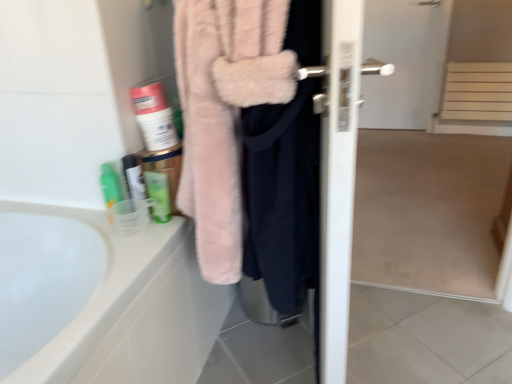
Measure the distance between point (465,11) and camera.

Point (465,11) is 3.20 meters from camera.

This screenshot has width=512, height=384. Describe the element at coordinates (135, 184) in the screenshot. I see `translucent plastic cup at lower left, the second toiletry positioned from the left` at that location.

The width and height of the screenshot is (512, 384). Describe the element at coordinates (154, 117) in the screenshot. I see `white matte bottle at upper left` at that location.

Describe the element at coordinates (282, 198) in the screenshot. I see `fuzzy pink robe at center` at that location.

What is the approximate width of fuzzy pink robe at center?

12.69 centimeters.

The image size is (512, 384). What do you see at coordinates (224, 112) in the screenshot?
I see `fluffy pink towel at upper right` at bounding box center [224, 112].

This screenshot has height=384, width=512. In order to click on white matte screen door at center in this screenshot , I will do `click(432, 159)`.

Which object is positioned more to the right, fuzzy pink robe at center or fluffy pink towel at upper right?

fuzzy pink robe at center is more to the right.

From a real-world perspective, is fuzzy pink robe at center physically above fluffy pink towel at upper right?

No, from a real-world perspective, fuzzy pink robe at center is not over fluffy pink towel at upper right

Considering the sizes of objects fuzzy pink robe at center and fluffy pink towel at upper right in the image provided, who is thinner, fuzzy pink robe at center or fluffy pink towel at upper right?

fuzzy pink robe at center is thinner.

Is fuzzy pink robe at center aimed at fluffy pink towel at upper right?

Yes, fuzzy pink robe at center is facing fluffy pink towel at upper right.

Looking at this image, which object is closer to the camera taking this photo, fluffy pink towel at upper right or translucent plastic cup at lower left, arranged as the 1th toiletry when viewed from the left?

Positioned in front is fluffy pink towel at upper right.

Based on their sizes in the image, would you say fluffy pink towel at upper right is bigger or smaller than translucent plastic cup at lower left, arranged as the third toiletry when viewed from the right?

Clearly, fluffy pink towel at upper right is larger in size than translucent plastic cup at lower left, arranged as the third toiletry when viewed from the right.

Could you measure the distance between fluffy pink towel at upper right and translucent plastic cup at lower left, arranged as the 1th toiletry when viewed from the left?

fluffy pink towel at upper right and translucent plastic cup at lower left, arranged as the 1th toiletry when viewed from the left, are 16.92 inches apart.

Which point is more forward, [192,194] or [106,187]?

The point [192,194] is closer to the camera.

How different are the orientations of translucent plastic cup at lower left, the second toiletry positioned from the left, and white matte bottle at upper left in degrees?

They differ by 0.0127 degrees in their facing directions.

Considering the relative positions of translucent plastic cup at lower left, the second toiletry positioned from the left, and white matte bottle at upper left in the image provided, is translucent plastic cup at lower left, the second toiletry positioned from the left, to the left or to the right of white matte bottle at upper left?

From the image, it's evident that translucent plastic cup at lower left, the second toiletry positioned from the left, is to the left of white matte bottle at upper left.

Are translucent plastic cup at lower left, the second toiletry positioned from the left, and white matte bottle at upper left far apart?

No.

From the image's perspective, relative to white matte bottle at upper left, is translucent plastic cup at lower left, the second toiletry positioned from the left, above or below?

From the image's perspective, translucent plastic cup at lower left, the second toiletry positioned from the left, appears below white matte bottle at upper left.

From a real-world perspective, is translucent plastic cup at lower left, the second toiletry positioned from the left, physically above green matte tube at upper left, the 1th toiletry viewed from the right?

Yes, from a real-world perspective, translucent plastic cup at lower left, the second toiletry positioned from the left, is on top of green matte tube at upper left, the 1th toiletry viewed from the right.

Which of these two, translucent plastic cup at lower left, the second toiletry positioned from the left, or green matte tube at upper left, the 1th toiletry viewed from the right, stands taller?

translucent plastic cup at lower left, the second toiletry positioned from the left, is taller.

Considering the relative positions of translucent plastic cup at lower left, placed as the second toiletry when sorted from right to left, and green matte tube at upper left, positioned as the 3th toiletry in left-to-right order, in the image provided, is translucent plastic cup at lower left, placed as the second toiletry when sorted from right to left, to the right of green matte tube at upper left, positioned as the 3th toiletry in left-to-right order, from the viewer's perspective?

Incorrect, translucent plastic cup at lower left, placed as the second toiletry when sorted from right to left, is not on the right side of green matte tube at upper left, positioned as the 3th toiletry in left-to-right order.

Is translucent plastic cup at lower left, placed as the second toiletry when sorted from right to left, facing away from green matte tube at upper left, positioned as the 3th toiletry in left-to-right order?

translucent plastic cup at lower left, placed as the second toiletry when sorted from right to left, is not turned away from green matte tube at upper left, positioned as the 3th toiletry in left-to-right order.

From a real-world perspective, does fluffy pink towel at upper right sit lower than fuzzy pink robe at center?

No, from a real-world perspective, fluffy pink towel at upper right is not under fuzzy pink robe at center.

Is fluffy pink towel at upper right taller or shorter than fuzzy pink robe at center?

Clearly, fluffy pink towel at upper right is shorter compared to fuzzy pink robe at center.

Measure the distance from fluffy pink towel at upper right to fuzzy pink robe at center.

3.91 inches.

Is fluffy pink towel at upper right aimed at fuzzy pink robe at center?

Yes, fluffy pink towel at upper right faces towards fuzzy pink robe at center.

From a real-world perspective, who is located lower, translucent plastic cup at lower left, arranged as the 1th toiletry when viewed from the left, or translucent plastic cup at lower left, the second toiletry positioned from the left?

From a 3D spatial view, translucent plastic cup at lower left, arranged as the 1th toiletry when viewed from the left, is below.

How different are the orientations of translucent plastic cup at lower left, arranged as the third toiletry when viewed from the right, and translucent plastic cup at lower left, placed as the second toiletry when sorted from right to left, in degrees?

The facing directions of translucent plastic cup at lower left, arranged as the third toiletry when viewed from the right, and translucent plastic cup at lower left, placed as the second toiletry when sorted from right to left, are 0.0162 degrees apart.

Does translucent plastic cup at lower left, arranged as the 1th toiletry when viewed from the left, have a smaller size compared to translucent plastic cup at lower left, placed as the second toiletry when sorted from right to left?

Indeed, translucent plastic cup at lower left, arranged as the 1th toiletry when viewed from the left, has a smaller size compared to translucent plastic cup at lower left, placed as the second toiletry when sorted from right to left.

Is translucent plastic cup at lower left, arranged as the 1th toiletry when viewed from the left, with translucent plastic cup at lower left, placed as the second toiletry when sorted from right to left?

Indeed, translucent plastic cup at lower left, arranged as the 1th toiletry when viewed from the left, and translucent plastic cup at lower left, placed as the second toiletry when sorted from right to left, are beside each other and touching.

Is fuzzy pink robe at center outside of translucent plastic cup at lower left, arranged as the 1th toiletry when viewed from the left?

Yes.

In the scene shown: Is fuzzy pink robe at center oriented towards translucent plastic cup at lower left, arranged as the 1th toiletry when viewed from the left?

Yes, fuzzy pink robe at center is aimed at translucent plastic cup at lower left, arranged as the 1th toiletry when viewed from the left.

Does fuzzy pink robe at center have a smaller size compared to translucent plastic cup at lower left, arranged as the third toiletry when viewed from the right?

No.

How different are the orientations of fuzzy pink robe at center and translucent plastic cup at lower left, arranged as the third toiletry when viewed from the right, in degrees?

76.9 degrees separate the facing orientations of fuzzy pink robe at center and translucent plastic cup at lower left, arranged as the third toiletry when viewed from the right.

In order to click on clothing below the fluffy pink towel at upper right (from a real-world perspective) in this screenshot , I will do `click(282, 198)`.

The image size is (512, 384). Identify the location of towel on the right side of translucent plastic cup at lower left, arranged as the third toiletry when viewed from the right. coord(224,112).

When comparing their distances from white matte screen door at center, does translucent plastic cup at lower left, arranged as the 1th toiletry when viewed from the left, or green matte tube at upper left, the 1th toiletry viewed from the right, seem closer?

green matte tube at upper left, the 1th toiletry viewed from the right.

Estimate the real-world distances between objects in this image. Which object is closer to translucent plastic cup at lower left, the second toiletry positioned from the left, fuzzy pink robe at center or translucent plastic cup at lower left, arranged as the third toiletry when viewed from the right?

Among the two, translucent plastic cup at lower left, arranged as the third toiletry when viewed from the right, is located nearer to translucent plastic cup at lower left, the second toiletry positioned from the left.

Looking at the image, which one is located closer to green matte tube at upper left, the 1th toiletry viewed from the right, translucent plastic cup at lower left, arranged as the third toiletry when viewed from the right, or translucent plastic cup at lower left, the second toiletry positioned from the left?

translucent plastic cup at lower left, the second toiletry positioned from the left, is positioned closer to the anchor green matte tube at upper left, the 1th toiletry viewed from the right.

Considering their positions, is translucent plastic cup at lower left, the second toiletry positioned from the left, positioned closer to fluffy pink towel at upper right than fuzzy pink robe at center?

fuzzy pink robe at center is closer to fluffy pink towel at upper right.

Considering their positions, is fluffy pink towel at upper right positioned further to translucent plastic cup at lower left, arranged as the third toiletry when viewed from the right, than white matte screen door at center?

white matte screen door at center is further to translucent plastic cup at lower left, arranged as the third toiletry when viewed from the right.

Consider the image. Based on their spatial positions, is fluffy pink towel at upper right or green matte tube at upper left, the 1th toiletry viewed from the right, further from translucent plastic cup at lower left, arranged as the third toiletry when viewed from the right?

fluffy pink towel at upper right is further to translucent plastic cup at lower left, arranged as the third toiletry when viewed from the right.

Consider the image. Estimate the real-world distances between objects in this image. Which object is closer to translucent plastic cup at lower left, arranged as the 1th toiletry when viewed from the left, white matte screen door at center or green matte tube at upper left, positioned as the 3th toiletry in left-to-right order?

Based on the image, green matte tube at upper left, positioned as the 3th toiletry in left-to-right order, appears to be nearer to translucent plastic cup at lower left, arranged as the 1th toiletry when viewed from the left.

When comparing their distances from translucent plastic cup at lower left, placed as the second toiletry when sorted from right to left, does green matte tube at upper left, positioned as the 3th toiletry in left-to-right order, or white matte screen door at center seem further?

white matte screen door at center is positioned further to the anchor translucent plastic cup at lower left, placed as the second toiletry when sorted from right to left.

In order to click on toiletry between white matte bottle at upper left and translucent plastic cup at lower left, arranged as the third toiletry when viewed from the right, vertically in this screenshot , I will do click(x=135, y=184).

At what (x,y) coordinates should I click in order to perform the action: click on toiletry positioned between fluffy pink towel at upper right and green matte tube at upper left, the 1th toiletry viewed from the right, from near to far. Please return your answer as a coordinate pair (x, y). This screenshot has width=512, height=384. Looking at the image, I should click on (135, 184).

The height and width of the screenshot is (384, 512). I want to click on clothing between fluffy pink towel at upper right and white matte screen door at center from left to right, so click(282, 198).

This screenshot has height=384, width=512. Find the location of `clothing between fluffy pink towel at upper right and green matte tube at upper left, the 1th toiletry viewed from the right, from front to back`. clothing between fluffy pink towel at upper right and green matte tube at upper left, the 1th toiletry viewed from the right, from front to back is located at coordinates (282, 198).